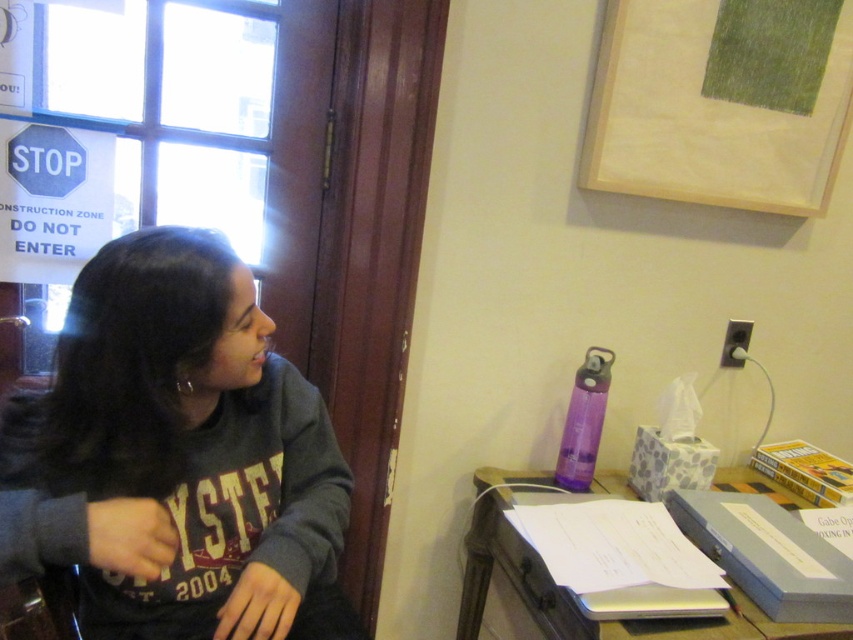
Does gray fleece sweatshirt at center have a larger size compared to metallic silver laptop at center?

No.

Is gray fleece sweatshirt at center closer to camera compared to metallic silver laptop at center?

Yes, gray fleece sweatshirt at center is closer to the viewer.

What do you see at coordinates (177, 458) in the screenshot? This screenshot has height=640, width=853. I see `gray fleece sweatshirt at center` at bounding box center [177, 458].

The height and width of the screenshot is (640, 853). What are the coordinates of `gray fleece sweatshirt at center` in the screenshot? It's located at (177, 458).